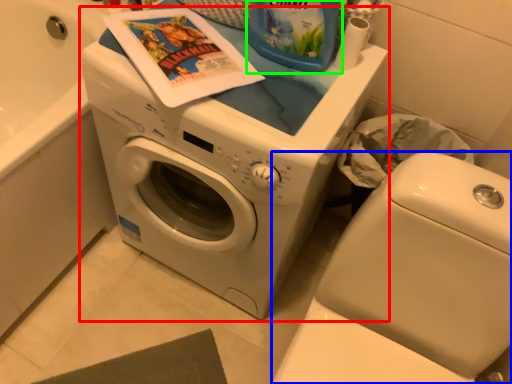
Question: Which object is the closest to the washing machine (highlighted by a red box)? Choose among these: washer (highlighted by a blue box) or cleaning product (highlighted by a green box).

Choices:
 (A) washer
 (B) cleaning product

Answer: (A)